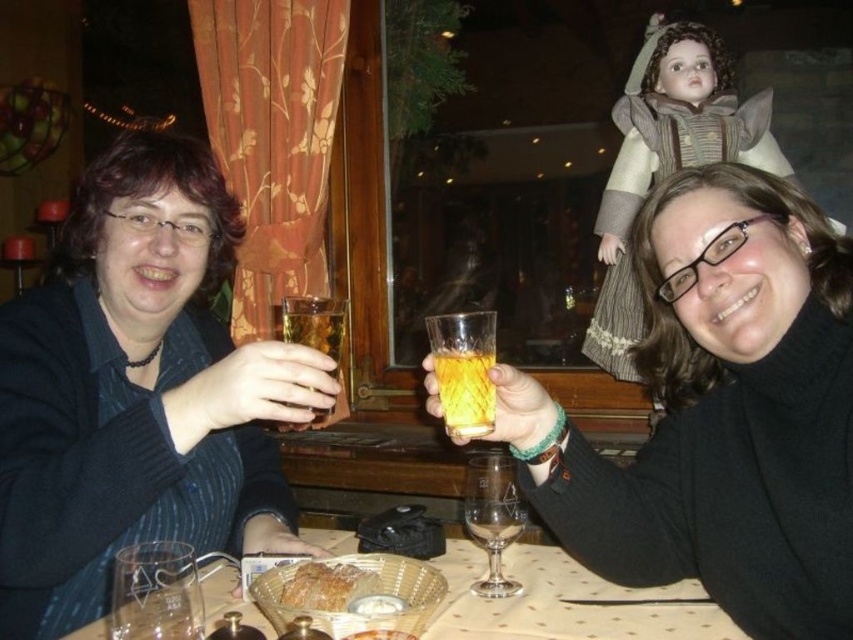
You are a waiter in a restaurant. You need to place a new menu on the table between the translucent amber liquid at center and the golden crispy bread at center. Is there enough space for the menu?

The translucent amber liquid at center is positioned over golden crispy bread at center, so there is no space between them. The menu cannot be placed between them.

You are a customer in a restaurant and want to place your napkin on the table. The napkin is 20 cm wide. The point representing the matte black sweater at upper left is at coordinate (137, 392). What is the minimum distance between the edge of the table and the point where the napkin will be placed to ensure it doesn

The minimum distance between the edge of the table and the point where the napkin will be placed should be at least 10 cm to ensure the napkin stays within the table.

You are a bartender who needs to pour more liquid into the clear glass wine glass at center and the translucent amber liquid at center. Which glass should you pour into first to avoid overflow?

The clear glass wine glass at center has a greater height compared to the translucent amber liquid at center, so you should pour into the translucent amber liquid at center first to prevent overflow.